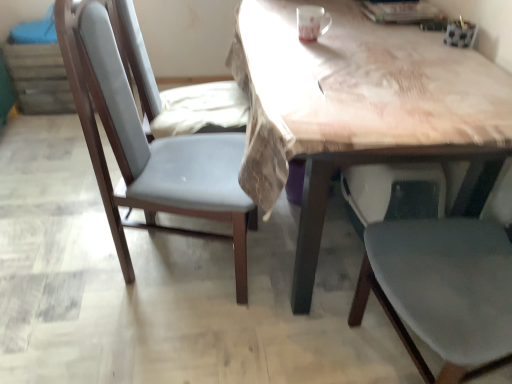
Question: From a real-world perspective, is wooden table at center positioned under matte gray chair at center based on gravity?

Choices:
 (A) yes
 (B) no

Answer: (B)

Question: Does wooden table at center appear on the right side of matte gray chair at center?

Choices:
 (A) no
 (B) yes

Answer: (B)

Question: From the image's perspective, is wooden table at center located beneath matte gray chair at center?

Choices:
 (A) no
 (B) yes

Answer: (A)

Question: Could matte gray chair at center be considered to be inside wooden table at center?

Choices:
 (A) no
 (B) yes

Answer: (A)

Question: Does wooden table at center appear on the left side of matte gray chair at center?

Choices:
 (A) yes
 (B) no

Answer: (B)

Question: Is wooden table at center positioned with its back to matte gray chair at center?

Choices:
 (A) yes
 (B) no

Answer: (B)

Question: Does matte gray chair at center have a lesser height compared to wooden table at center?

Choices:
 (A) no
 (B) yes

Answer: (A)

Question: Does matte gray chair at center have a larger size compared to wooden table at center?

Choices:
 (A) no
 (B) yes

Answer: (A)

Question: Is matte gray chair at center facing towards wooden table at center?

Choices:
 (A) no
 (B) yes

Answer: (B)

Question: Is matte gray chair at center thinner than wooden table at center?

Choices:
 (A) no
 (B) yes

Answer: (B)

Question: Is matte gray chair at center wider than wooden table at center?

Choices:
 (A) yes
 (B) no

Answer: (B)

Question: From the image's perspective, would you say matte gray chair at center is shown under wooden table at center?

Choices:
 (A) yes
 (B) no

Answer: (A)

Question: Is matte gray chair at center bigger or smaller than wooden table at center?

Choices:
 (A) big
 (B) small

Answer: (B)